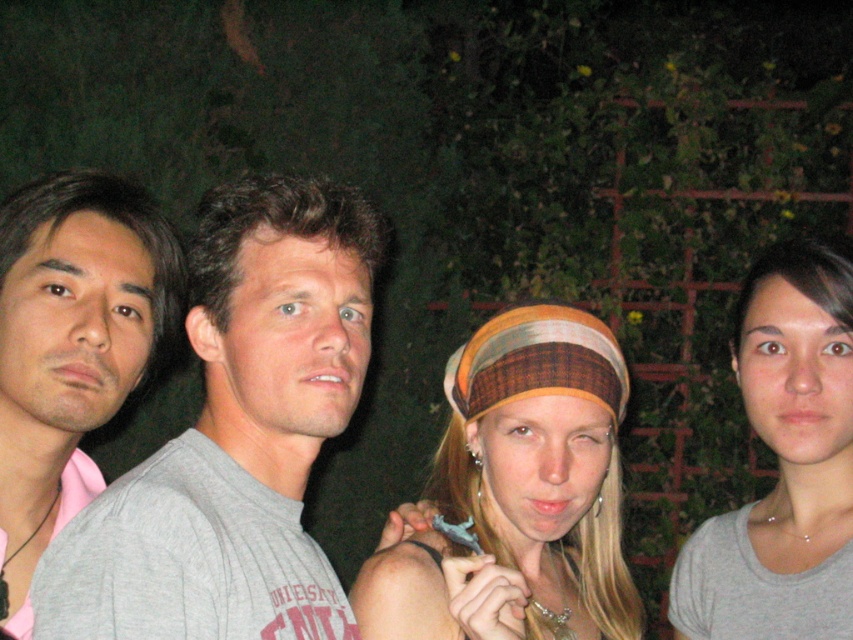
You are a photographer trying to frame a shot of the matte gray shirt at left and the multicolored fabric headband at center. The camera can only focus on objects within 12 inches of each other. Will both subjects be in focus?

The distance between the matte gray shirt at left and the multicolored fabric headband at center is 15.03 inches. Since the camera requires objects to be within 12 inches for focus, they are too far apart to both be in focus.

You are a photographer adjusting the camera focus. The multicolored fabric headband at center and the matte gray shirt at left are both in the frame. Which object will require you to adjust the focus to a wider setting due to its larger size?

The multicolored fabric headband at center requires a wider focus setting because its width is larger than the matte gray shirt at left.